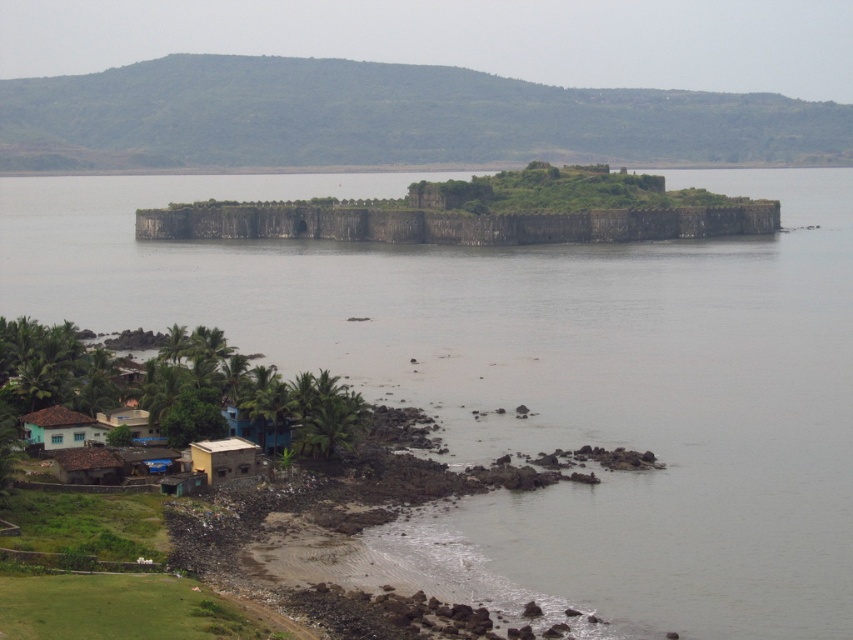
Can you confirm if yellow matte hut at lower left is positioned below brown corrugated roof hut at lower left?

Actually, yellow matte hut at lower left is above brown corrugated roof hut at lower left.

Does yellow matte hut at lower left lie in front of brown corrugated roof hut at lower left?

No.

Image resolution: width=853 pixels, height=640 pixels. Describe the element at coordinates (224, 458) in the screenshot. I see `yellow matte hut at lower left` at that location.

Locate an element on the screen. yellow matte hut at lower left is located at coordinates (224, 458).

Who is more distant from viewer, (228, 467) or (236, 424)?

Point (236, 424)

Does yellow matte hut at lower left appear on the left side of blue corrugated metal hut at lower center?

In fact, yellow matte hut at lower left is to the right of blue corrugated metal hut at lower center.

Locate an element on the screen. yellow matte hut at lower left is located at coordinates (224, 458).

Between gray water at center and brown corrugated roof hut at lower left, which one appears on the left side from the viewer's perspective?

brown corrugated roof hut at lower left is more to the left.

Is point (809, 513) in front of point (109, 481)?

That is True.

Between point (508, 401) and point (70, 480), which one is positioned in front?

Point (70, 480) is more forward.

At what (x,y) coordinates should I click in order to perform the action: click on gray water at center. Please return your answer as a coordinate pair (x, y). The height and width of the screenshot is (640, 853). Looking at the image, I should click on (535, 384).